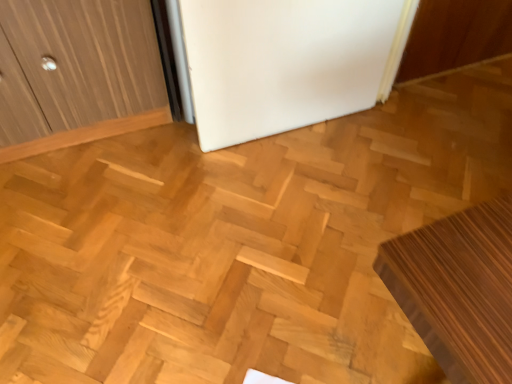
This screenshot has width=512, height=384. Find the location of `vacant space situated on the left part of wooden bench at lower right`. vacant space situated on the left part of wooden bench at lower right is located at coordinates (274, 289).